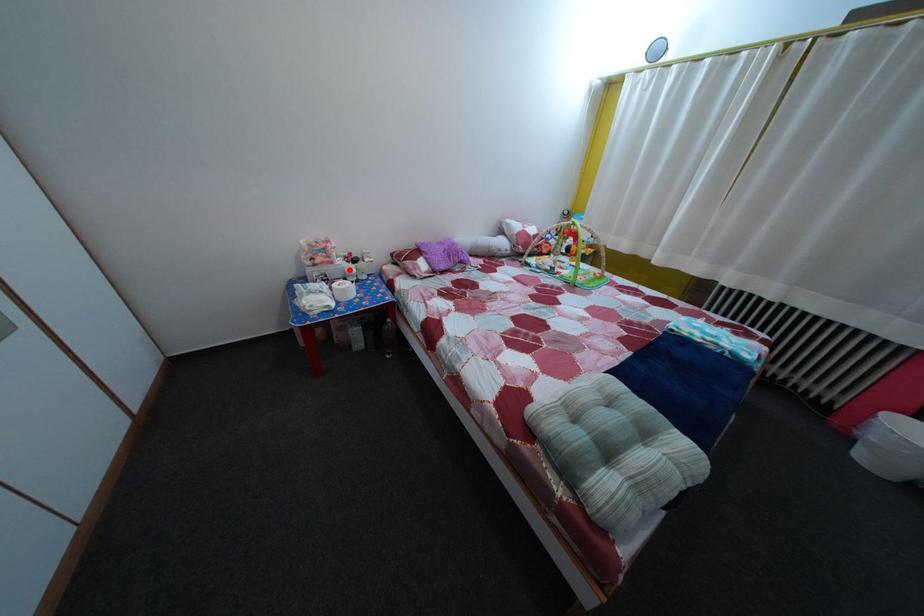
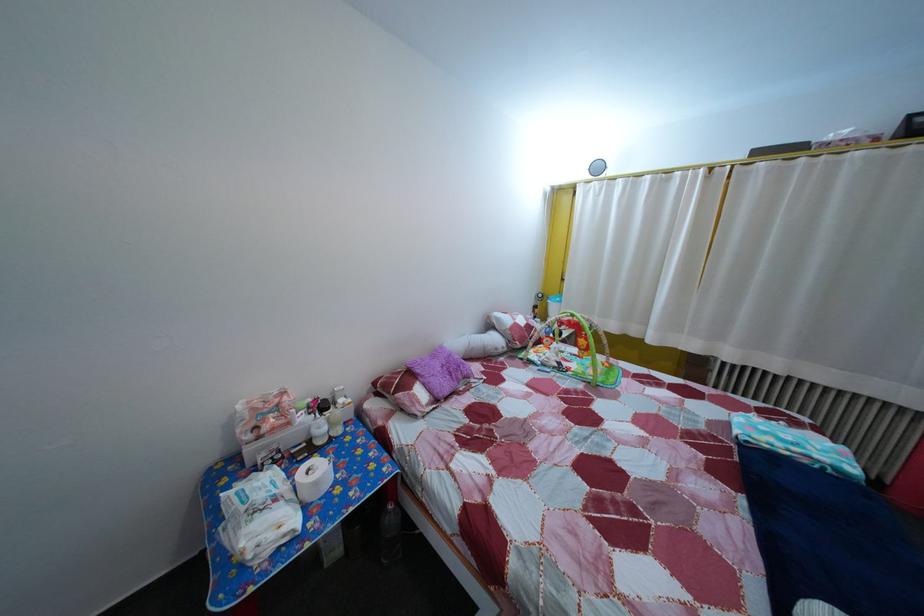
Question: I am providing you with two images of the same scene from different viewpoints. Given a red point in image1, look at the same physical point in image2. Is it:

Choices:
 (A) Closer to the viewpoint
 (B) Farther from the viewpoint

Answer: (B)